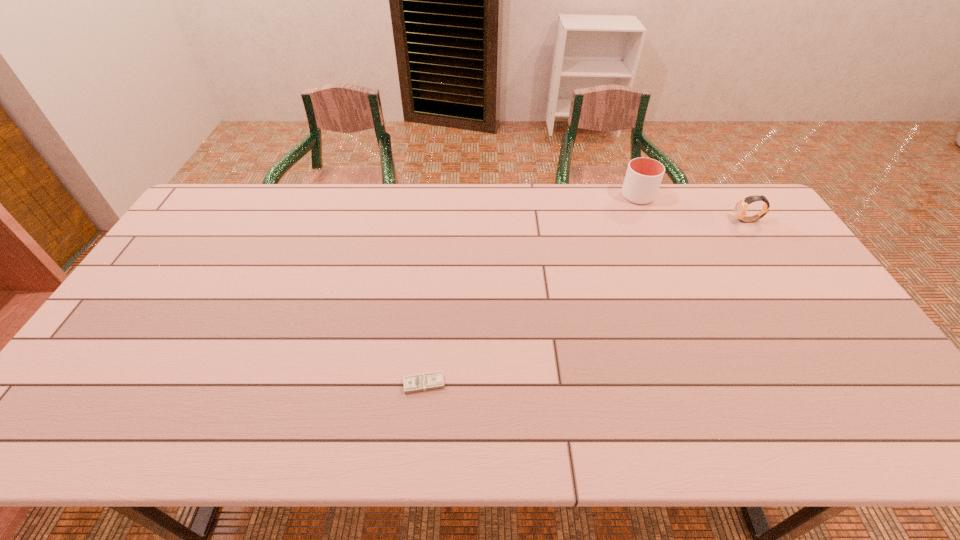
Identify the location of free space between the leftmost object and the second nearest object. (586, 302).

Where is `blank region between the cup and the money`? blank region between the cup and the money is located at coordinates (531, 289).

Locate an element on the screen. Image resolution: width=960 pixels, height=540 pixels. empty space between the second object from right to left and the rightmost object is located at coordinates (693, 208).

Image resolution: width=960 pixels, height=540 pixels. Find the location of `vacant space that is in between the second object from right to left and the leftmost object`. vacant space that is in between the second object from right to left and the leftmost object is located at coordinates (531, 289).

At what (x,y) coordinates should I click in order to perform the action: click on vacant region between the rightmost object and the second object from left to right. Please return your answer as a coordinate pair (x, y). Looking at the image, I should click on (693, 208).

The width and height of the screenshot is (960, 540). Identify the location of free area in between the shortest object and the farthest object. (531, 289).

Where is `unoccupied area between the second tallest object and the money`? The height and width of the screenshot is (540, 960). unoccupied area between the second tallest object and the money is located at coordinates (586, 302).

This screenshot has width=960, height=540. What are the coordinates of `vacant area that lies between the nearest object and the rightmost object` in the screenshot? It's located at (586, 302).

I want to click on vacant space in between the rightmost object and the farthest object, so click(x=693, y=208).

Locate which object is the closest to the watch. Please provide its 2D coordinates. Your answer should be formatted as a tuple, i.e. [(x, y)], where the tuple contains the x and y coordinates of a point satisfying the conditions above.

[(643, 178)]